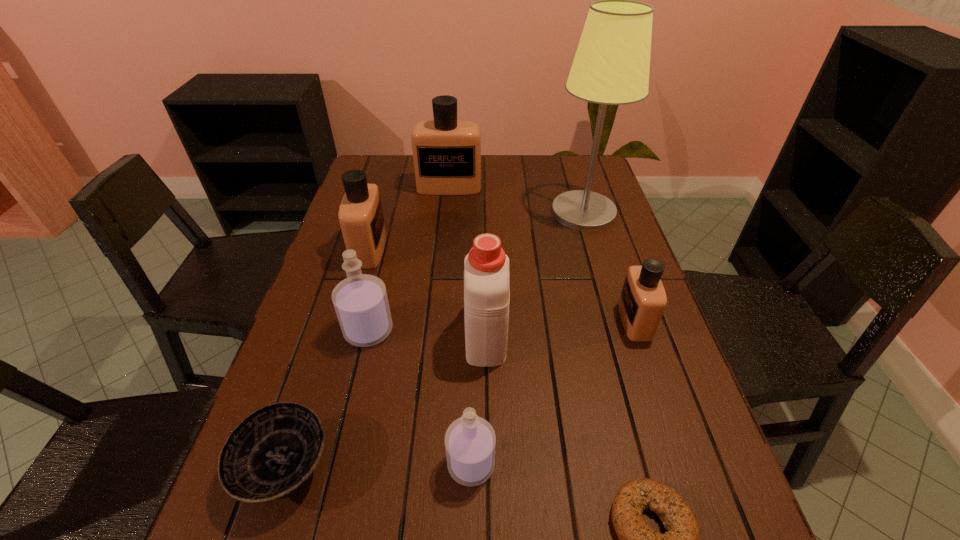
Image resolution: width=960 pixels, height=540 pixels. I want to click on vacant area located 0.100m on the front label of the smallest beige perfume, so click(580, 321).

Locate an element on the screen. The width and height of the screenshot is (960, 540). vacant region located 0.210m on the front label of the smallest beige perfume is located at coordinates (535, 321).

Image resolution: width=960 pixels, height=540 pixels. In order to click on free space located 0.060m on the front label of the smallest beige perfume in this screenshot , I will do `click(596, 321)`.

This screenshot has width=960, height=540. Identify the location of free space located 0.210m on the left of the nearer purple perfume. (333, 464).

This screenshot has width=960, height=540. In order to click on vacant region located on the right of the second shortest object in this screenshot , I will do `click(365, 469)`.

Find the location of a particular element. object situated at the far edge is located at coordinates (447, 152).

Identify the location of bowl situated at the left edge. This screenshot has height=540, width=960. (272, 453).

Identify the location of table lamp present at the right edge. (611, 66).

I want to click on perfume at the right edge, so click(x=642, y=302).

Where is `free space at the left edge of the desktop`? free space at the left edge of the desktop is located at coordinates (345, 394).